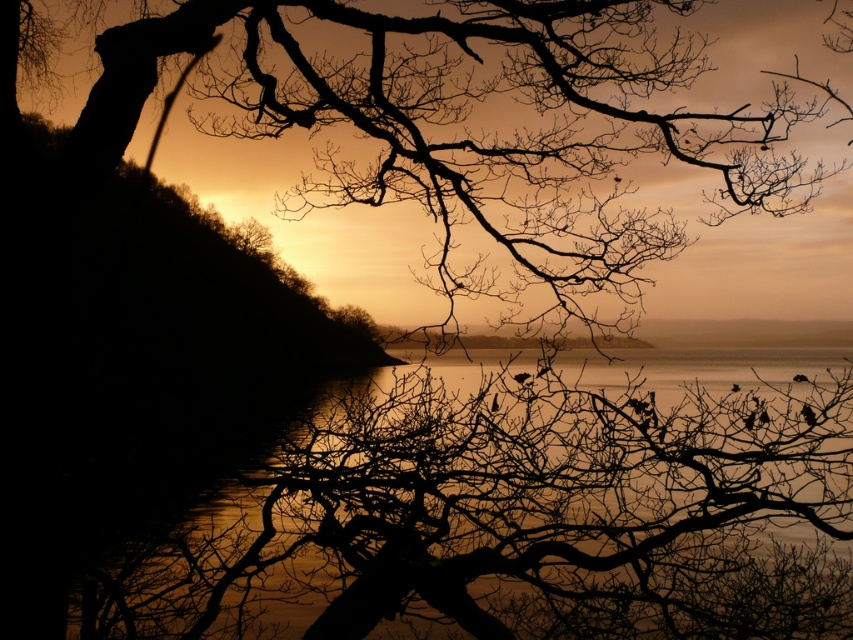
You are an artist trying to paint the sunset scene. You have to decide which area to focus on first based on their sizes. Which object should you paint first, the glossy water at center or the silhouette bark tree at upper left?

The silhouette bark tree at upper left is thicker than the glossy water at center, so you should paint the silhouette bark tree at upper left first as it has a larger size.

You are standing at the edge of the water in the sunset scene. You notice two points marked in the image. The first point is at coordinates point (120, 593) and the second is at point (328, 74). Which point is closer to you?

Point (120, 593) is in front of point (328, 74), so the first point is closer to you.